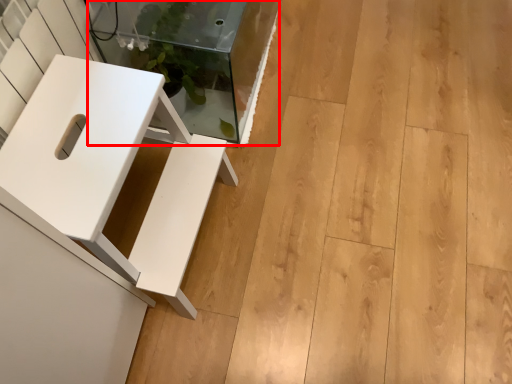
Question: From the image's perspective, where is glass table (annotated by the red box) located in relation to furniture in the image?

Choices:
 (A) above
 (B) below

Answer: (A)